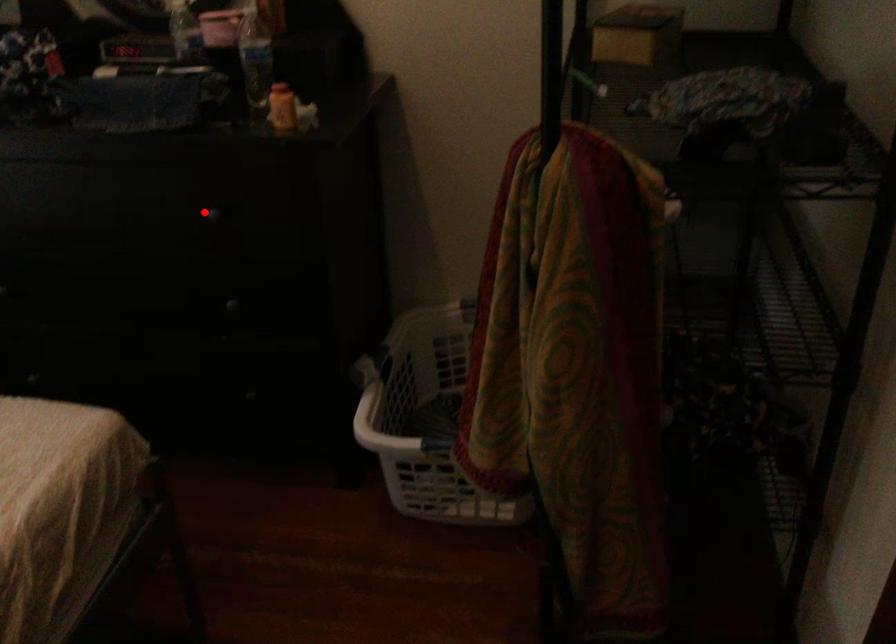
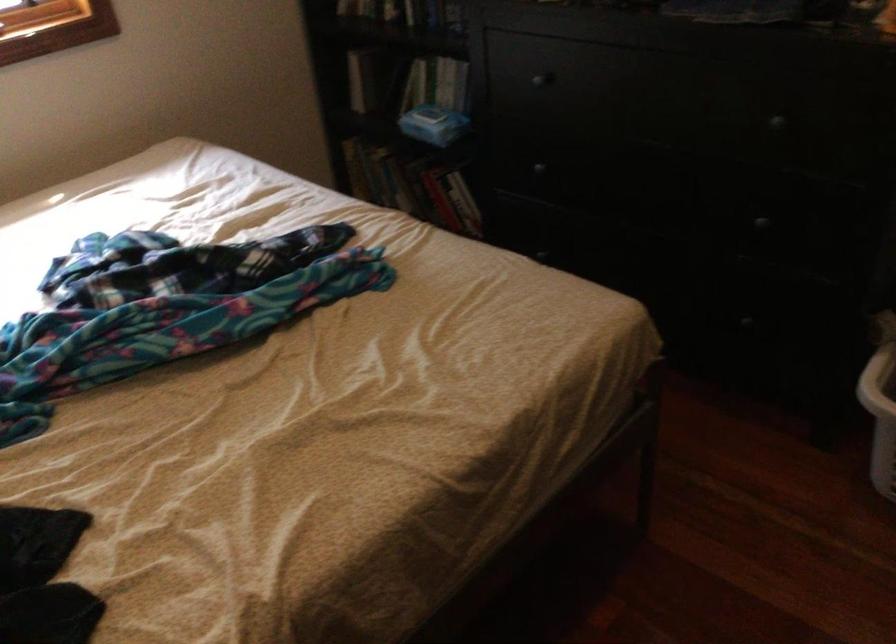
Locate, in the second image, the point that corresponds to the highlighted location in the first image.

(773, 122)